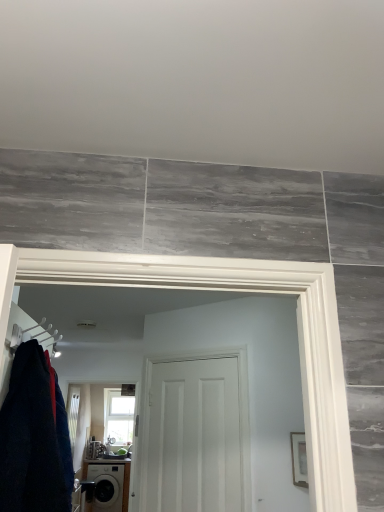
What do you see at coordinates (118, 417) in the screenshot?
I see `clear glass window at upper center` at bounding box center [118, 417].

What is the approximate width of clear glass window at upper center?

clear glass window at upper center is 7.62 inches wide.

The width and height of the screenshot is (384, 512). I want to click on white matte ceiling at upper center, so (x=197, y=81).

Considering the positions of point (101, 480) and point (60, 339), is point (101, 480) closer or farther from the camera than point (60, 339)?

Clearly, point (101, 480) is more distant from the camera than point (60, 339).

Is matte black washing machine at lower left to the right of white plastic hanger at left from the viewer's perspective?

Incorrect, matte black washing machine at lower left is not on the right side of white plastic hanger at left.

Considering the sizes of objects matte black washing machine at lower left and white plastic hanger at left in the image provided, who is thinner, matte black washing machine at lower left or white plastic hanger at left?

white plastic hanger at left is thinner.

Is white matte door at center situated inside dark blue fabric at left or outside?

white matte door at center is located beyond the bounds of dark blue fabric at left.

In order to click on clothing in front of the white matte door at center in this screenshot , I will do `click(30, 440)`.

Are white matte door at center and dark blue fabric at left located far from each other?

That's right, there is a large distance between white matte door at center and dark blue fabric at left.

Based on the photo, from a real-world perspective, who is located higher, white matte door at center or dark blue fabric at left?

dark blue fabric at left.

Is clear glass window at upper center completely or partially outside of white matte door at center?

Yes, clear glass window at upper center is outside of white matte door at center.

Is clear glass window at upper center thinner than white matte door at center?

Incorrect, the width of clear glass window at upper center is not less than that of white matte door at center.

How much distance is there between clear glass window at upper center and white matte door at center?

They are 2.96 meters apart.

Is clear glass window at upper center located outside white plastic hanger at left?

clear glass window at upper center is positioned outside white plastic hanger at left.

Between clear glass window at upper center and white plastic hanger at left, which one has smaller width?

white plastic hanger at left is thinner.

From the image's perspective, which one is positioned higher, clear glass window at upper center or white plastic hanger at left?

white plastic hanger at left appears higher in the image.

Can you tell me how much clear glass window at upper center and white plastic hanger at left differ in facing direction?

The facing directions of clear glass window at upper center and white plastic hanger at left are 94.3 degrees apart.

Can you confirm if matte black washing machine at lower left is taller than clear glass window at upper center?

No, matte black washing machine at lower left is not taller than clear glass window at upper center.

Does matte black washing machine at lower left have a larger size compared to clear glass window at upper center?

Correct, matte black washing machine at lower left is larger in size than clear glass window at upper center.

Does matte black washing machine at lower left appear on the left side of clear glass window at upper center?

Yes, matte black washing machine at lower left is to the left of clear glass window at upper center.

From the image's perspective, is matte black washing machine at lower left under clear glass window at upper center?

Yes, from the image's perspective, matte black washing machine at lower left is below clear glass window at upper center.

Considering the sizes of white matte ceiling at upper center and dark blue fabric at left in the image, is white matte ceiling at upper center taller or shorter than dark blue fabric at left?

Considering their sizes, white matte ceiling at upper center has less height than dark blue fabric at left.

Would you say dark blue fabric at left is part of white matte ceiling at upper center's contents?

Definitely not — dark blue fabric at left is not inside white matte ceiling at upper center.

Based on the photo, from a real-world perspective, is white matte ceiling at upper center physically located above or below dark blue fabric at left?

In terms of real-world spatial position, white matte ceiling at upper center is above dark blue fabric at left.

Is white matte ceiling at upper center smaller than dark blue fabric at left?

Yes.

From a real-world perspective, does dark blue fabric at left stand above white plastic hanger at left?

No, from a real-world perspective, dark blue fabric at left is not above white plastic hanger at left.

Considering the positions of objects dark blue fabric at left and white plastic hanger at left in the image provided, who is more to the right, dark blue fabric at left or white plastic hanger at left?

From the viewer's perspective, dark blue fabric at left appears more on the right side.

Could you tell me if dark blue fabric at left is turned towards white plastic hanger at left?

No, dark blue fabric at left does not turn towards white plastic hanger at left.

Where is `washing machine located behind the white plastic hanger at left`? The width and height of the screenshot is (384, 512). washing machine located behind the white plastic hanger at left is located at coordinates (108, 484).

Locate an element on the screen. This screenshot has width=384, height=512. clothing on the left of white matte door at center is located at coordinates (30, 440).

Looking at the image, which one is located further to clear glass window at upper center, white plastic hanger at left or white matte ceiling at upper center?

Based on the image, white matte ceiling at upper center appears to be further to clear glass window at upper center.

Looking at this image, from the image, which object appears to be farther from white matte ceiling at upper center, white plastic hanger at left or dark blue fabric at left?

The object further to white matte ceiling at upper center is dark blue fabric at left.

Which object lies nearer to the anchor point dark blue fabric at left, white matte ceiling at upper center or matte black washing machine at lower left?

The object closer to dark blue fabric at left is white matte ceiling at upper center.

Looking at the image, which one is located closer to white matte ceiling at upper center, clear glass window at upper center or white matte door at center?

white matte door at center is positioned closer to the anchor white matte ceiling at upper center.

Considering their positions, is dark blue fabric at left positioned closer to clear glass window at upper center than matte black washing machine at lower left?

matte black washing machine at lower left.

From the image, which object appears to be nearer to white matte door at center, white plastic hanger at left or white matte ceiling at upper center?

Based on the image, white plastic hanger at left appears to be nearer to white matte door at center.

Based on their spatial positions, is white plastic hanger at left or clear glass window at upper center closer to dark blue fabric at left?

white plastic hanger at left is positioned closer to the anchor dark blue fabric at left.

From the image, which object appears to be farther from white matte ceiling at upper center, white plastic hanger at left or white matte door at center?

white matte door at center is positioned further to the anchor white matte ceiling at upper center.

The image size is (384, 512). Identify the location of hanger located between white matte ceiling at upper center and white matte door at center in the depth direction. (34, 335).

Identify the location of clothing between white matte ceiling at upper center and clear glass window at upper center along the z-axis. The image size is (384, 512). (30, 440).

Locate an element on the screen. hanger that lies between white matte ceiling at upper center and dark blue fabric at left from top to bottom is located at coordinates (34, 335).

Identify the location of washing machine between dark blue fabric at left and clear glass window at upper center along the z-axis. (108, 484).